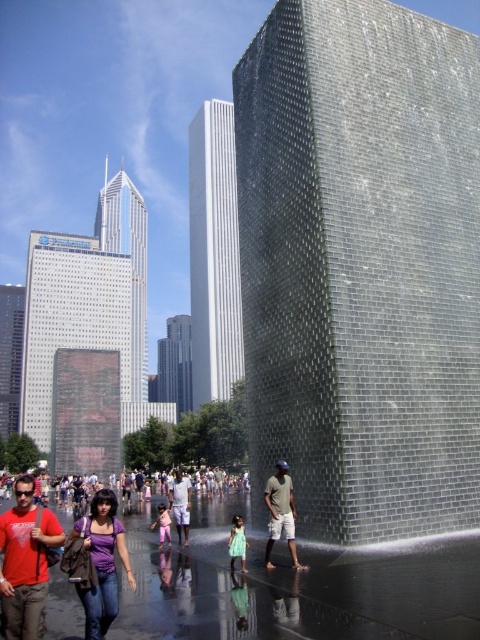
You are a photographer trying to capture both the purple matte shirt at center and the light purple shirt at center in a single frame. Which of the two shirts should you focus on first to ensure they both fit in the photo?

The purple matte shirt at center occupies less space than the light purple shirt at center, so you should focus on the light purple shirt at center first to ensure both fit in the photo.